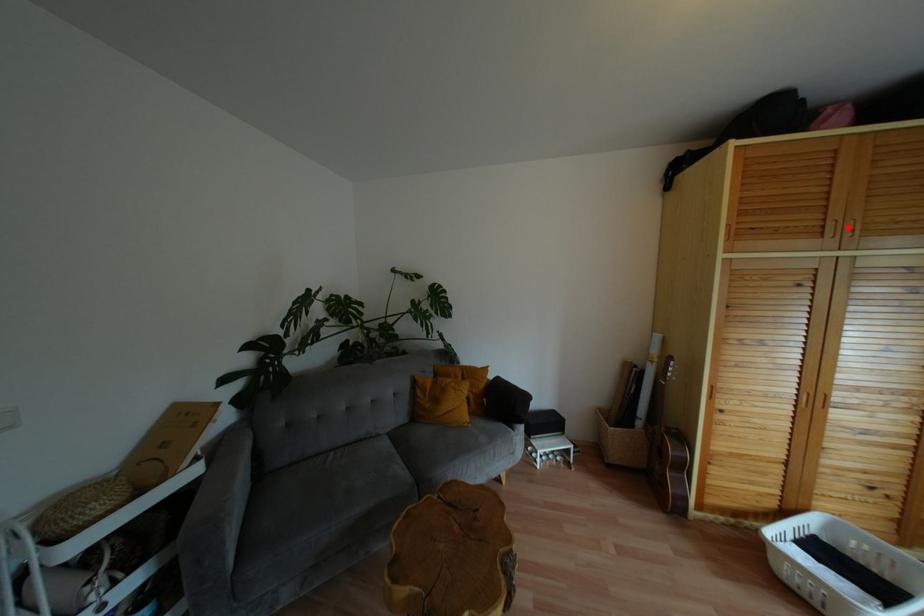
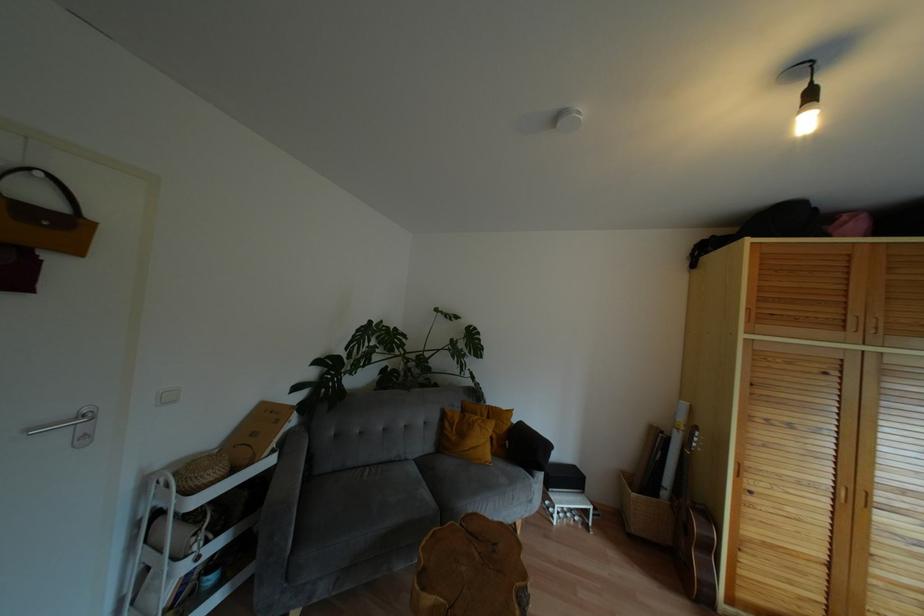
The point at the highlighted location is marked in the first image. Where is the corresponding point in the second image?

(870, 323)